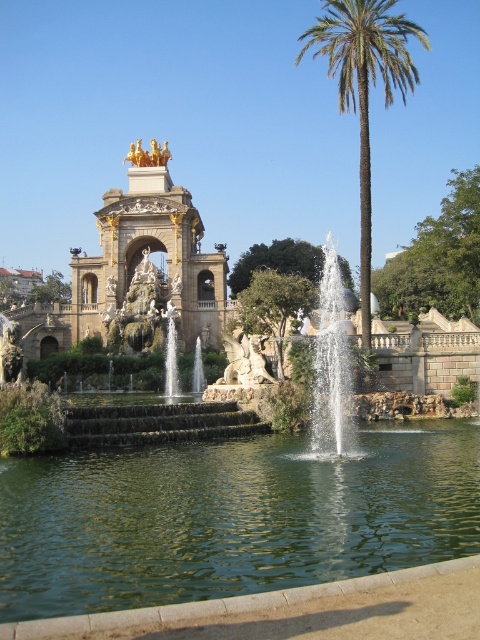
Question: Which object is positioned farthest from the green liquid water at center?

Choices:
 (A) green leafy palm tree at right
 (B) clear glass fountain at center

Answer: (A)

Question: Which point is farther to the camera?

Choices:
 (A) (339, 467)
 (B) (348, 371)
 (C) (360, 177)

Answer: (C)

Question: Can you confirm if green leafy palm tree at right is smaller than clear glass fountain at center?

Choices:
 (A) no
 (B) yes

Answer: (A)

Question: Which object is positioned closest to the green liquid water at center?

Choices:
 (A) clear glass fountain at center
 (B) green leafy palm tree at right

Answer: (A)

Question: Is green liquid water at center to the right of green leafy palm tree at right from the viewer's perspective?

Choices:
 (A) yes
 (B) no

Answer: (B)

Question: Is green liquid water at center to the left of clear glass fountain at center from the viewer's perspective?

Choices:
 (A) no
 (B) yes

Answer: (B)